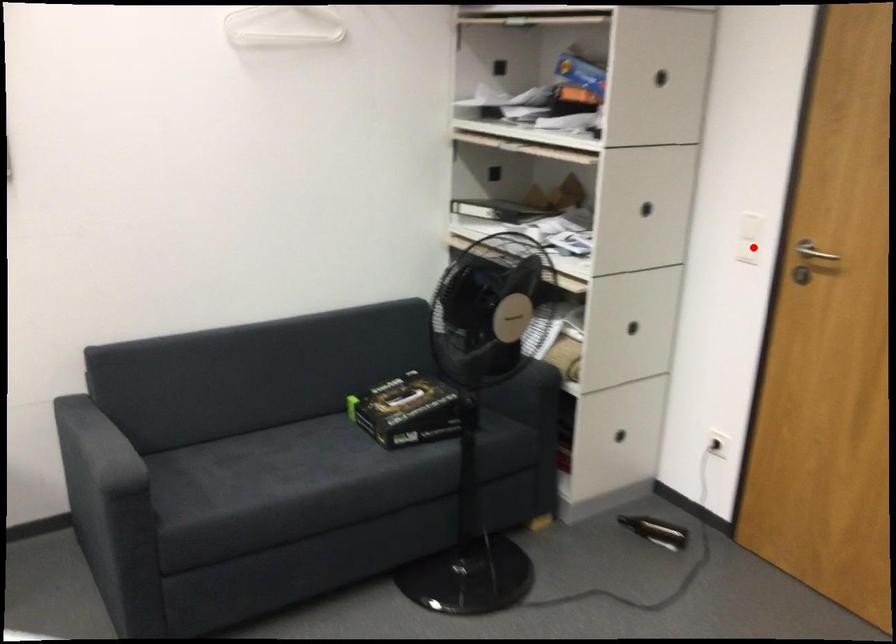
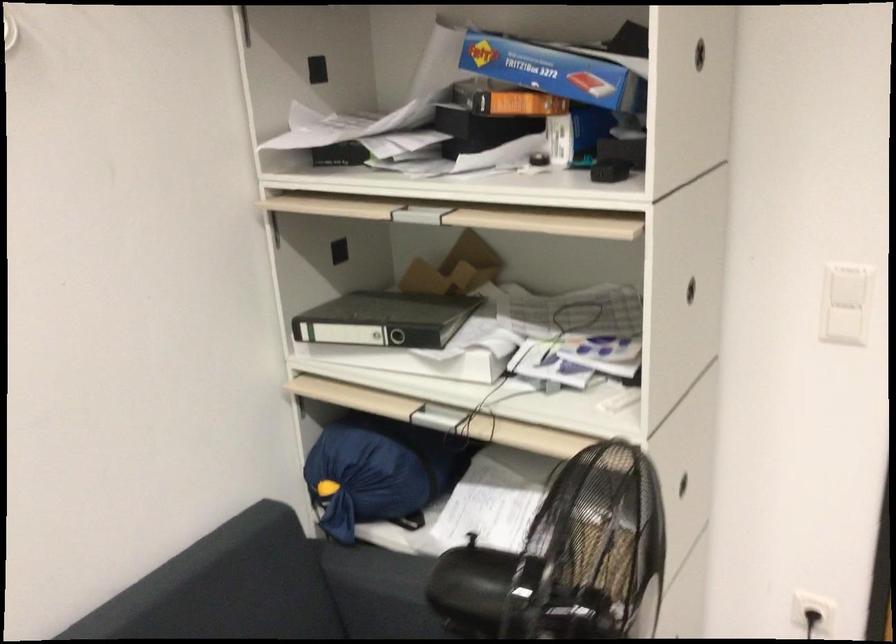
In the second image, find the point that corresponds to the highlighted location in the first image.

(843, 326)